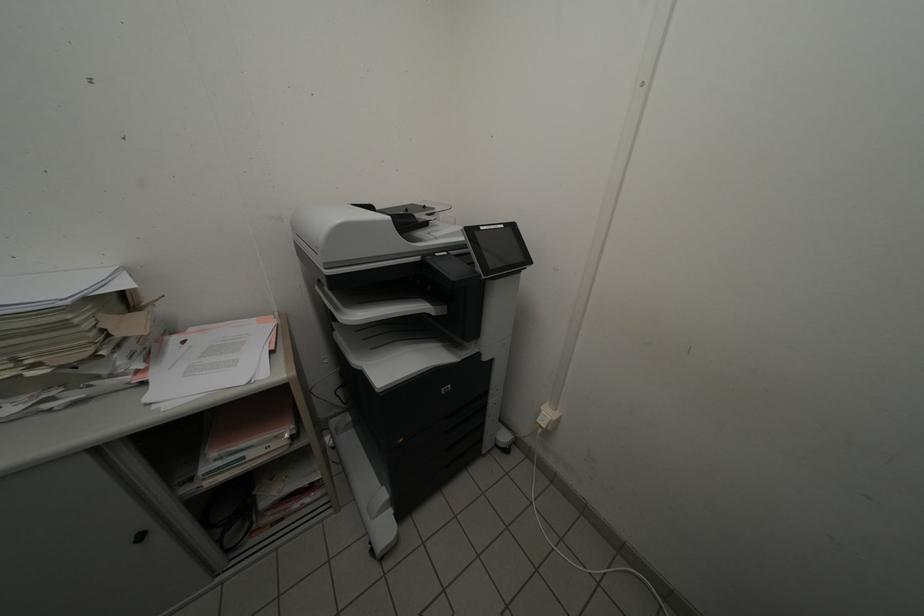
In order to click on black printer drawer in this screenshot , I will do `click(453, 436)`.